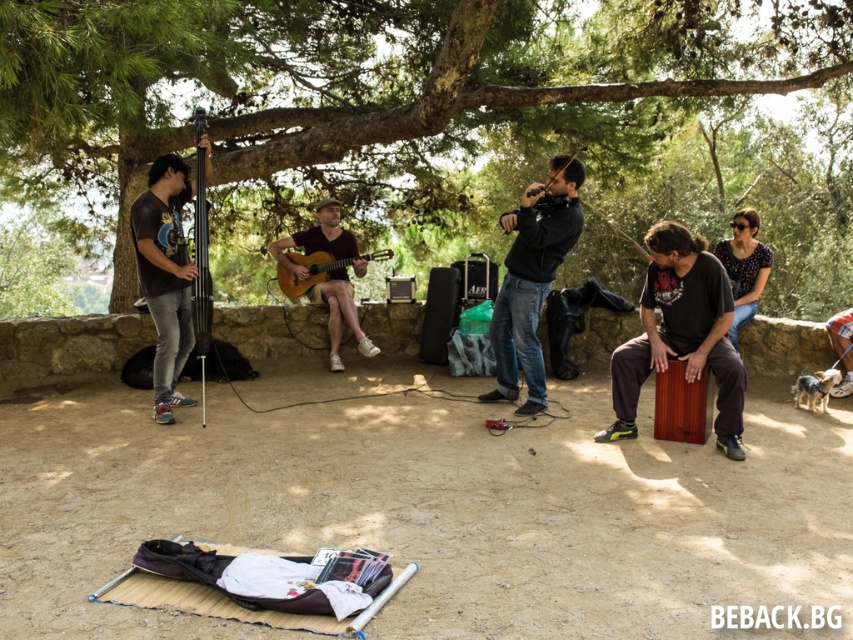
Between wooden cajon at center and floral shirt at upper right, which one appears on the left side from the viewer's perspective?

wooden cajon at center

Can you confirm if wooden cajon at center is thinner than floral shirt at upper right?

No.

The height and width of the screenshot is (640, 853). Identify the location of wooden cajon at center. (682, 333).

At what (x,y) coordinates should I click in order to perform the action: click on wooden cajon at center. Please return your answer as a coordinate pair (x, y). Looking at the image, I should click on (682, 333).

Can you confirm if green leafy tree at upper center is taller than wooden acoustic guitar at center?

Yes.

Which of these two, green leafy tree at upper center or wooden acoustic guitar at center, stands taller?

With more height is green leafy tree at upper center.

Where is `green leafy tree at upper center`? green leafy tree at upper center is located at coordinates (427, 129).

Can you confirm if black matte jacket at center is taller than matte black camera at center?

Indeed, black matte jacket at center has a greater height compared to matte black camera at center.

Which is in front, point (527, 394) or point (567, 193)?

Point (567, 193)

At what (x,y) coordinates should I click in order to perform the action: click on black matte jacket at center. Please return your answer as a coordinate pair (x, y). Image resolution: width=853 pixels, height=640 pixels. Looking at the image, I should click on (532, 276).